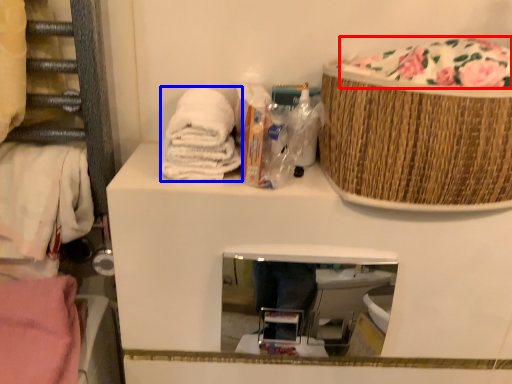
Question: Which point is further to the camera, food (highlighted by a red box) or material (highlighted by a blue box)?

Choices:
 (A) food
 (B) material

Answer: (B)